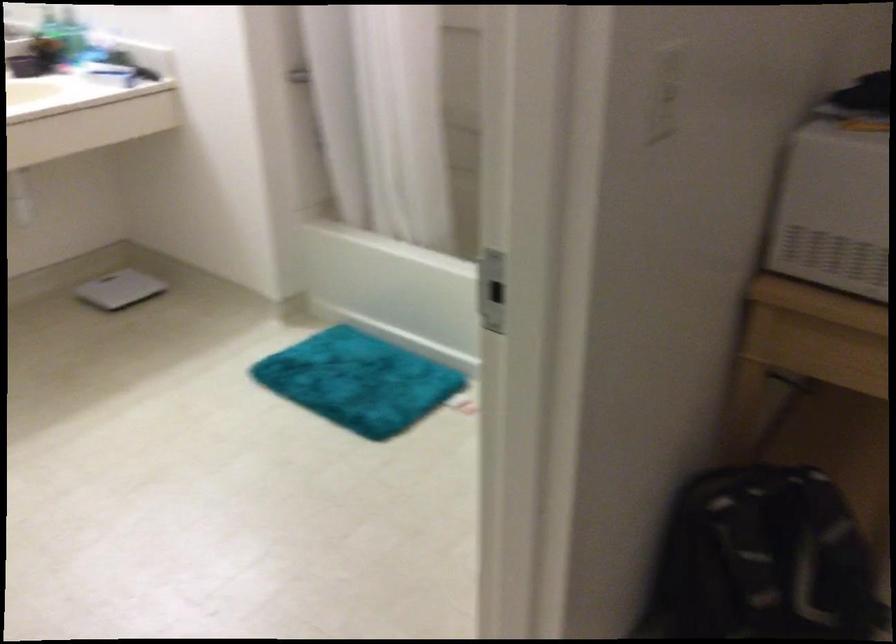
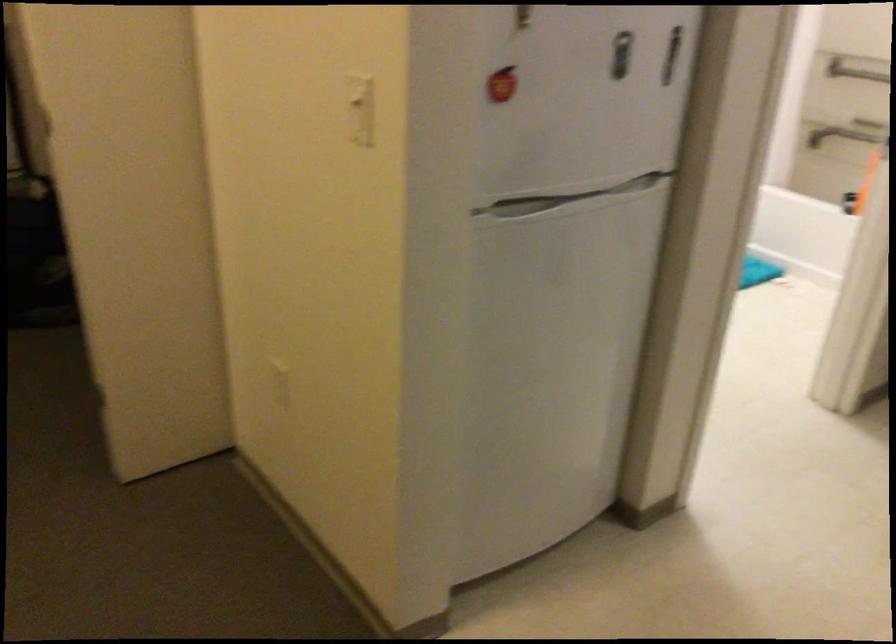
Question: I am providing you with two images of the same scene from different viewpoints. Please identify which objects are invisible in image2.

Choices:
 (A) white light switch
 (B) pink patterned skateboard
 (C) turquoise bath mat
 (D) refrigerator handle

Answer: (C)